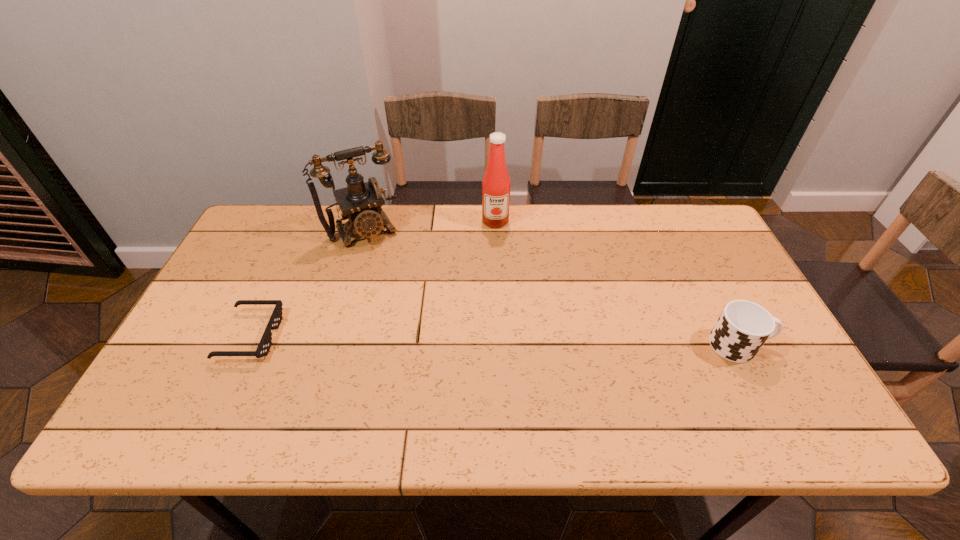
You are a GUI agent. You are given a task and a screenshot of the screen. Output one action in this format:
    pyautogui.click(x=<x>, y=<y>)
    Task: Click on the vacant space at the right edge of the desktop
    The height and width of the screenshot is (540, 960).
    Given the screenshot: What is the action you would take?
    pyautogui.click(x=780, y=351)

Image resolution: width=960 pixels, height=540 pixels. In order to click on free region at the far right corner in this screenshot , I will do `click(668, 213)`.

This screenshot has width=960, height=540. Find the location of `free spot at the near right corner of the desktop`. free spot at the near right corner of the desktop is located at coordinates (728, 373).

Where is `vacant point located between the rightmost object and the condiment`? The width and height of the screenshot is (960, 540). vacant point located between the rightmost object and the condiment is located at coordinates (617, 284).

This screenshot has height=540, width=960. Find the location of `vacant space that's between the rightmost object and the leftmost object`. vacant space that's between the rightmost object and the leftmost object is located at coordinates (494, 341).

The width and height of the screenshot is (960, 540). Identify the location of blank region between the third object from left to right and the second shortest object. (617, 284).

Identify the location of free space between the telephone and the cup. (552, 287).

Find the location of a particular element. This screenshot has height=540, width=960. unoccupied area between the third object from left to right and the leftmost object is located at coordinates (372, 279).

This screenshot has height=540, width=960. I want to click on free point between the cup and the condiment, so click(617, 284).

I want to click on vacant space that is in between the sunglasses and the second shortest object, so click(x=494, y=341).